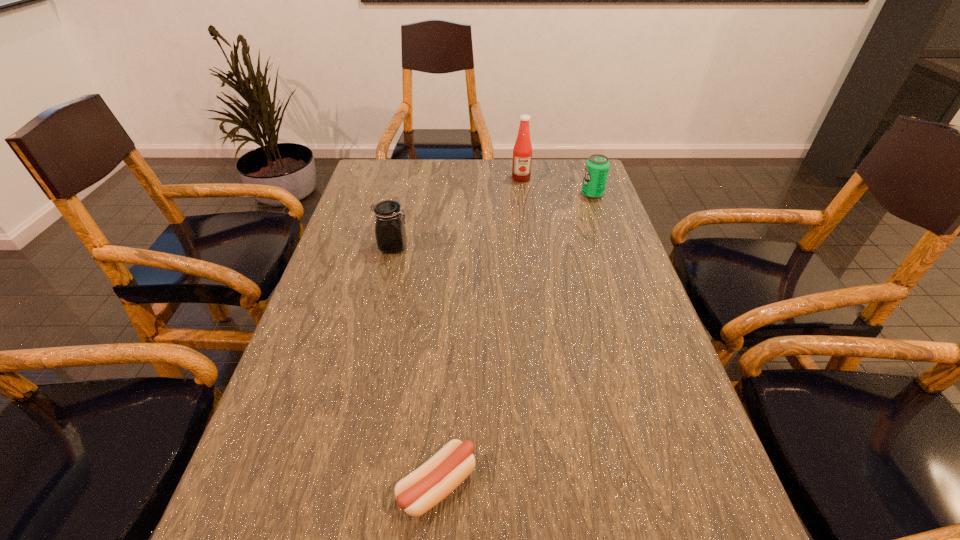
Identify the location of free region located on the front-facing side of the pop soda. This screenshot has height=540, width=960. (487, 194).

Where is `vacant space situated on the front-facing side of the pop soda`? vacant space situated on the front-facing side of the pop soda is located at coordinates (540, 194).

Locate an element on the screen. The width and height of the screenshot is (960, 540). vacant space located on the front-facing side of the pop soda is located at coordinates (527, 194).

At what (x,y) coordinates should I click in order to perform the action: click on vacant space located on the back of the third object from right to left. Please return your answer as a coordinate pair (x, y). Image resolution: width=960 pixels, height=540 pixels. Looking at the image, I should click on (450, 301).

At what (x,y) coordinates should I click in order to perform the action: click on condiment located in the far edge section of the desktop. Please return your answer as a coordinate pair (x, y). The width and height of the screenshot is (960, 540). Looking at the image, I should click on (522, 152).

Identify the location of pop soda situated at the far edge. This screenshot has width=960, height=540. (597, 166).

You are a GUI agent. You are given a task and a screenshot of the screen. Output one action in this format:
    pyautogui.click(x=<x>, y=<y>)
    Task: Click on the object at the left edge
    
    Given the screenshot: What is the action you would take?
    pyautogui.click(x=390, y=231)

This screenshot has height=540, width=960. Find the location of `object located at the right edge`. object located at the right edge is located at coordinates (597, 166).

The image size is (960, 540). What are the coordinates of `object present at the far right corner` in the screenshot? It's located at (597, 166).

Where is `vacant space at the far edge of the desktop`? vacant space at the far edge of the desktop is located at coordinates (439, 193).